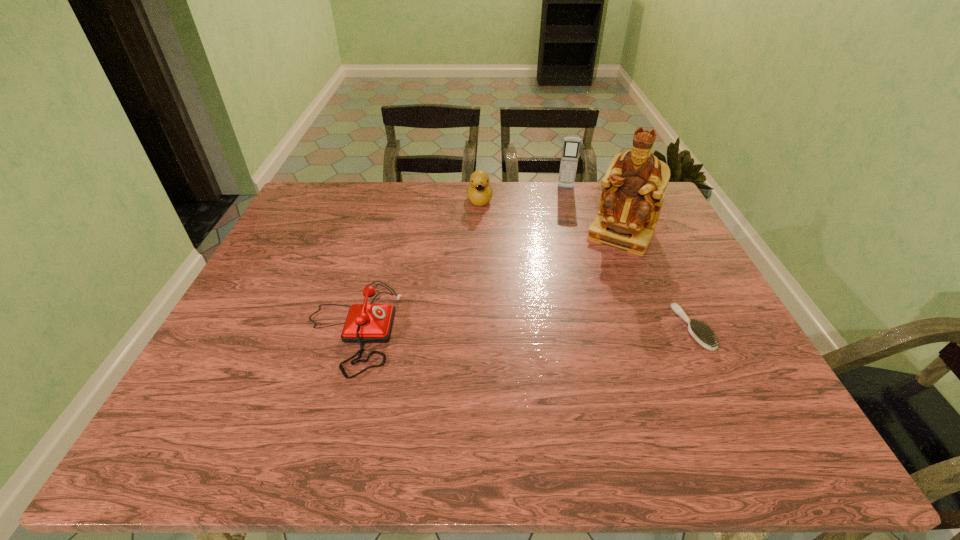
Find the location of a particular element. This screenshot has width=960, height=540. free space on the desktop that is between the fourth tallest object and the shortest object and is positioned on the front-facing side of the tallest object is located at coordinates (566, 328).

The height and width of the screenshot is (540, 960). What are the coordinates of `free space on the desktop that is between the leftmost object and the shortest object and is positioned on the face of the duckling` in the screenshot? It's located at tap(491, 328).

What are the coordinates of `vacant space on the desktop that is between the telephone and the scrubbing brush and is positioned on the front-facing side of the cellular telephone` in the screenshot? It's located at (561, 328).